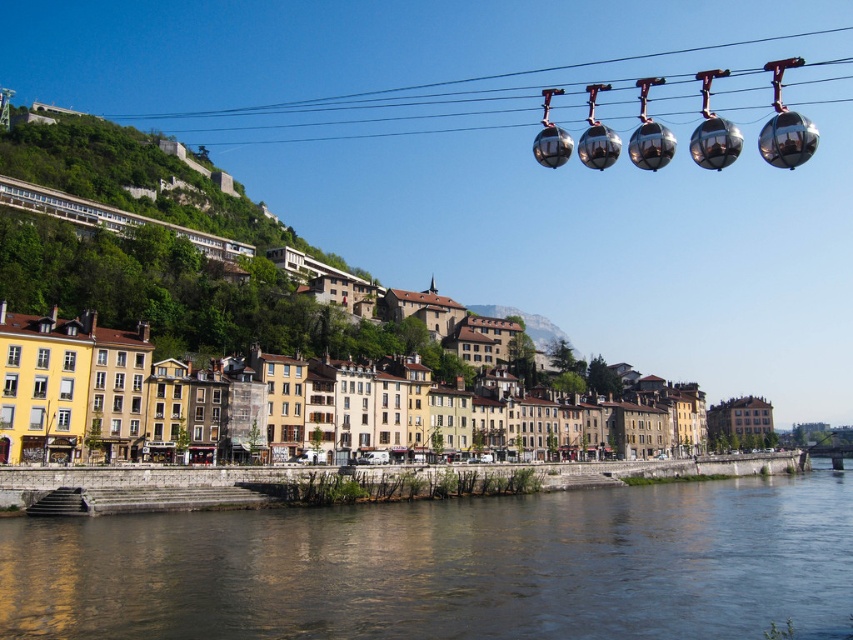
Question: Does transparent water at lower center appear over matte yellow building at lower center?

Choices:
 (A) yes
 (B) no

Answer: (B)

Question: Can you confirm if transparent water at lower center is positioned to the right of matte yellow building at lower center?

Choices:
 (A) yes
 (B) no

Answer: (A)

Question: In this image, where is transparent water at lower center located relative to matte yellow building at lower center?

Choices:
 (A) right
 (B) left

Answer: (A)